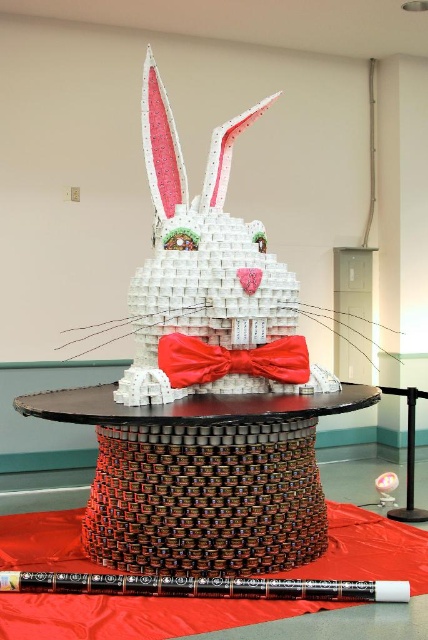
Question: Observing the image, what is the correct spatial positioning of wooden table at center in reference to shiny satin bow tie at center?

Choices:
 (A) left
 (B) right

Answer: (A)

Question: Can you confirm if wooden table at center is positioned to the right of shiny satin bow tie at center?

Choices:
 (A) yes
 (B) no

Answer: (B)

Question: Which point appears farthest from the camera in this image?

Choices:
 (A) (217, 369)
 (B) (278, 401)

Answer: (A)

Question: Can you confirm if wooden table at center is positioned above shiny satin bow tie at center?

Choices:
 (A) no
 (B) yes

Answer: (A)